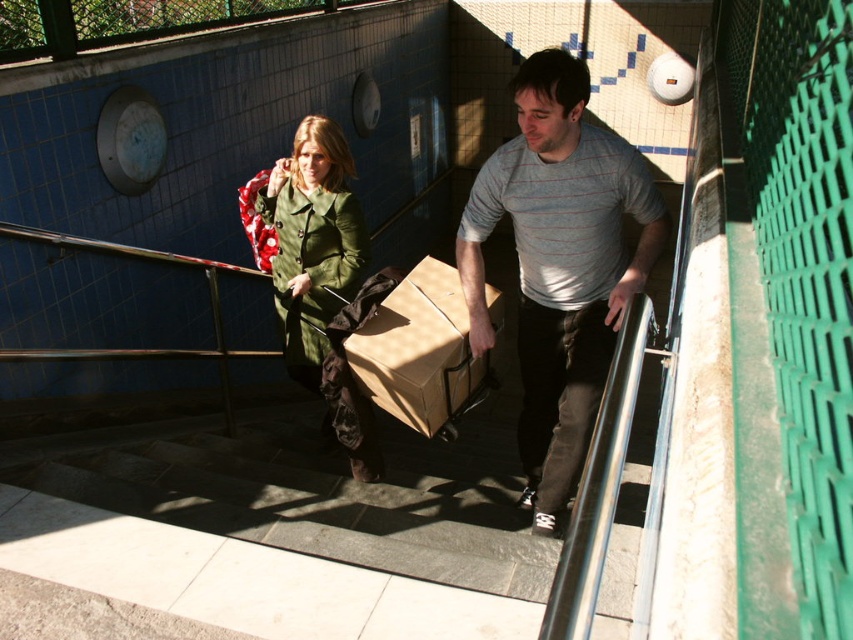
This screenshot has width=853, height=640. What do you see at coordinates (560, 264) in the screenshot?
I see `gray striped shirt at center` at bounding box center [560, 264].

You are a GUI agent. You are given a task and a screenshot of the screen. Output one action in this format:
    pyautogui.click(x=<x>, y=<y>)
    Task: Click on the gray striped shirt at center
    
    Given the screenshot: What is the action you would take?
    (560, 264)

Where is `gray striped shirt at center`? gray striped shirt at center is located at coordinates (x=560, y=264).

Image resolution: width=853 pixels, height=640 pixels. I want to click on gray striped shirt at center, so click(560, 264).

Does green matte coat at center have a lesser width compared to brown cardboard box at center?

Indeed, green matte coat at center has a lesser width compared to brown cardboard box at center.

Is green matte coat at center wider than brown cardboard box at center?

No.

Who is more forward, [318,337] or [440,356]?

Point [440,356] is in front.

What are the coordinates of `green matte coat at center` in the screenshot? It's located at (318, 275).

Describe the element at coordinates (560, 264) in the screenshot. I see `gray striped shirt at center` at that location.

Who is taller, gray striped shirt at center or brown cardboard box at center?

gray striped shirt at center

Does point (544, 90) lie behind point (416, 387)?

No, it is in front of (416, 387).

What are the coordinates of `gray striped shirt at center` in the screenshot? It's located at (560, 264).